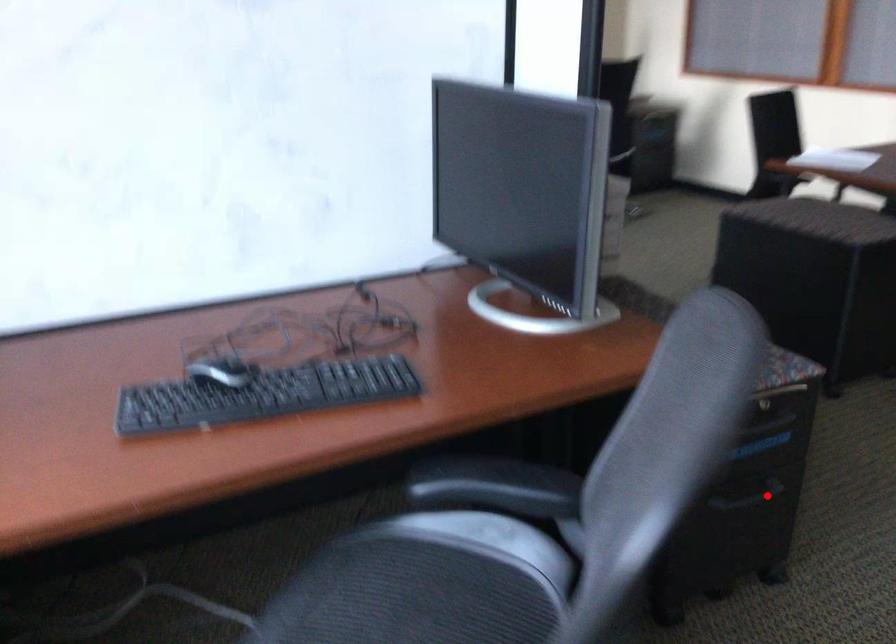
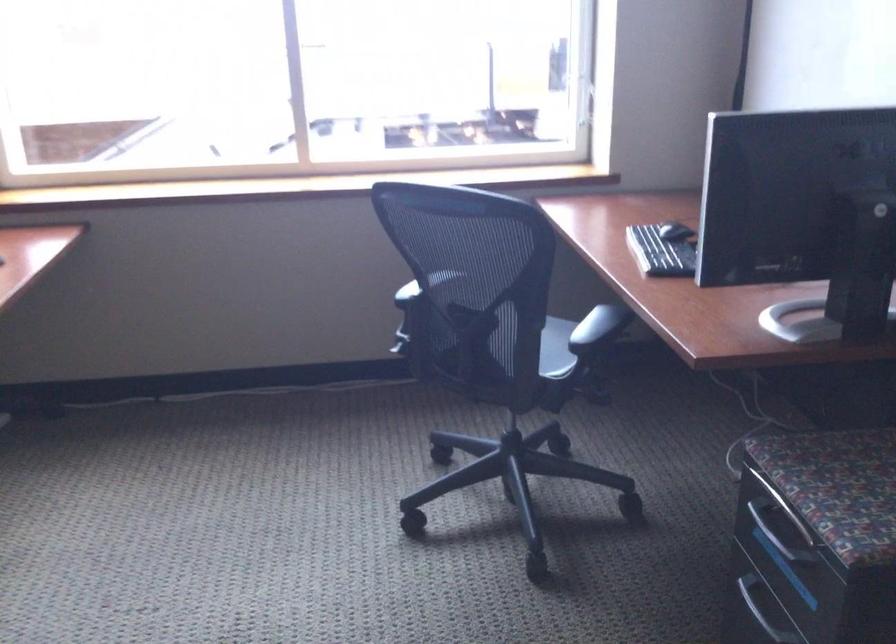
Find the pixel in the second image that matches the highlighted location in the first image.

(755, 614)